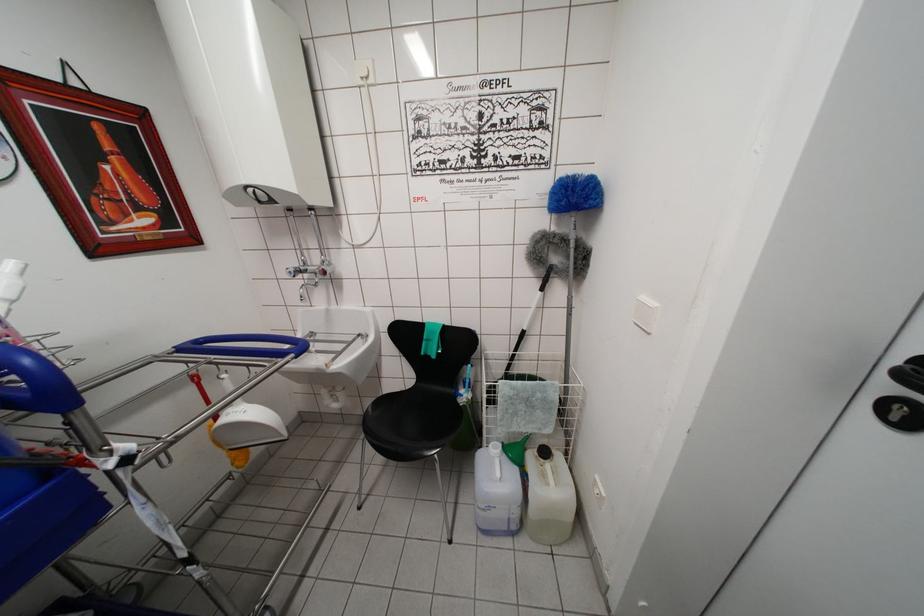
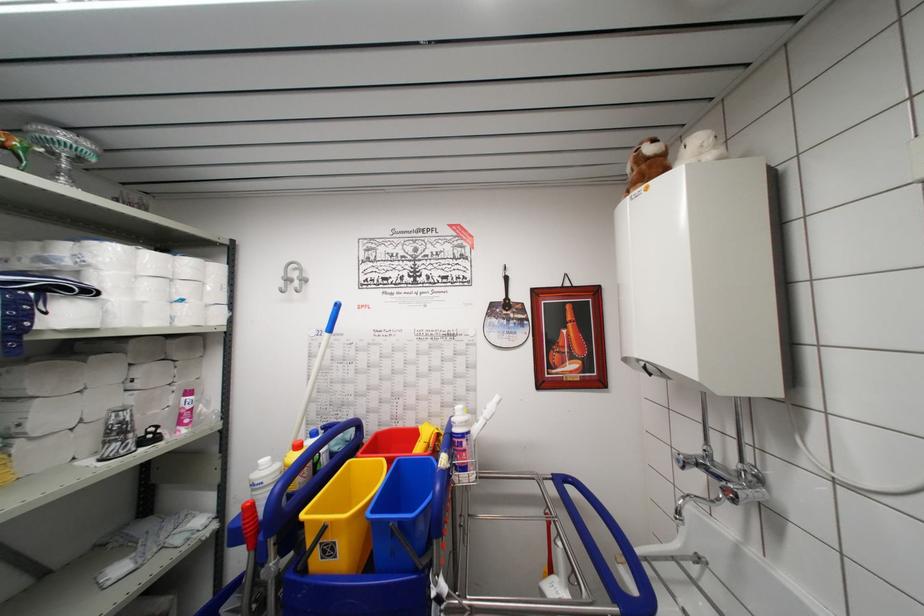
Question: The first image is from the beginning of the video and the second image is from the end. How did the camera likely rotate when shooting the video?

Choices:
 (A) Left
 (B) Right
 (C) Up
 (D) Down

Answer: (A)